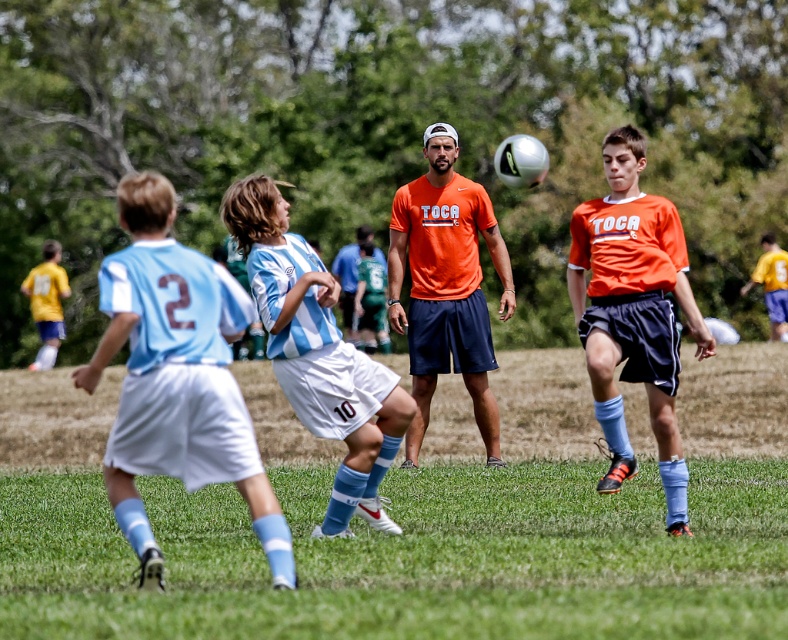
Question: Does light blue jersey at center appear over orange matte jersey at center?

Choices:
 (A) no
 (B) yes

Answer: (A)

Question: Considering the real-world distances, which object is closest to the orange matte shirt at center?

Choices:
 (A) matte green jersey at center
 (B) light blue jersey at center
 (C) orange matte jersey at center
 (D) green grass at center

Answer: (C)

Question: Does green grass at center appear over orange matte jersey at center?

Choices:
 (A) no
 (B) yes

Answer: (A)

Question: Among these points, which one is farthest from the camera?

Choices:
 (A) (346, 337)
 (B) (634, 253)
 (C) (160, 259)

Answer: (A)

Question: Which object is positioned closest to the green grass at center?

Choices:
 (A) light blue jersey at center
 (B) blue/white striped jersey at center
 (C) orange matte jersey at center
 (D) matte green jersey at center

Answer: (A)

Question: Can you confirm if blue/white striped jersey at center is smaller than matte green jersey at center?

Choices:
 (A) no
 (B) yes

Answer: (B)